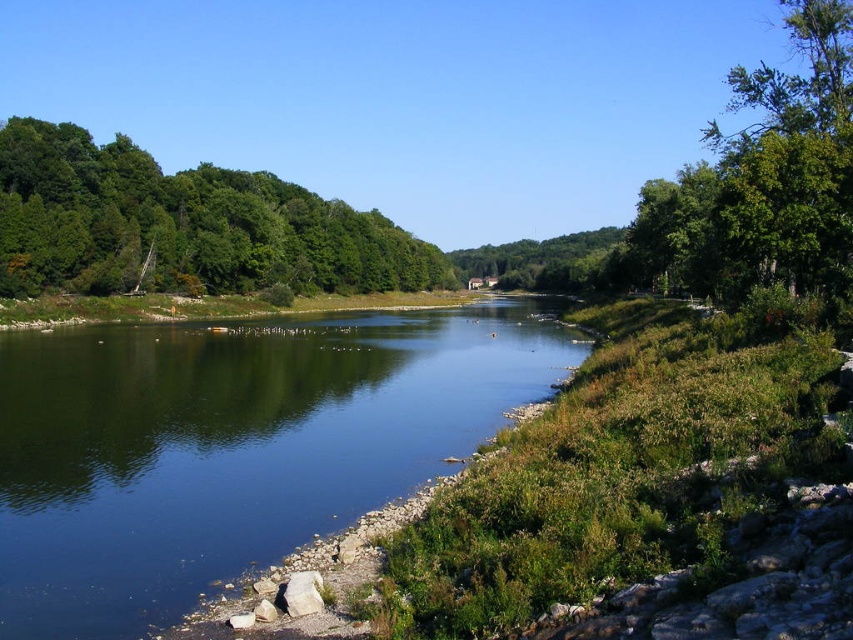
Based on the photo, which is more to the right, green smooth water at center or green leafy tree at upper right?

From the viewer's perspective, green leafy tree at upper right appears more on the right side.

Can you confirm if green smooth water at center is positioned to the left of green leafy tree at upper right?

Correct, you'll find green smooth water at center to the left of green leafy tree at upper right.

Is point (479, 387) farther from camera compared to point (630, 252)?

No, (479, 387) is in front of (630, 252).

Where is `green smooth water at center`? green smooth water at center is located at coordinates (231, 445).

Between point (363, 376) and point (416, 275), which one is positioned behind?

The point (416, 275) is more distant.

Which of these two, green smooth water at center or green leafy tree at upper left, stands shorter?

Standing shorter between the two is green smooth water at center.

Which is in front, point (386, 493) or point (20, 259)?

Point (386, 493) is more forward.

Find the location of a particular element. green smooth water at center is located at coordinates (231, 445).

Is green leafy tree at upper left below green leafy tree at upper right?

Yes, green leafy tree at upper left is below green leafy tree at upper right.

Does green leafy tree at upper left appear on the right side of green leafy tree at upper right?

In fact, green leafy tree at upper left is to the left of green leafy tree at upper right.

In order to click on green leafy tree at upper left in this screenshot , I will do `click(183, 225)`.